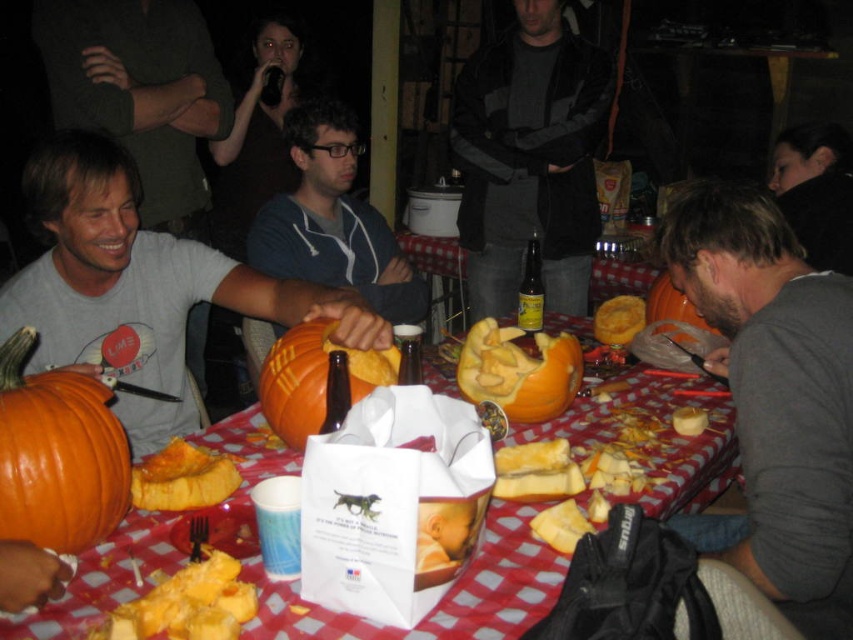
Question: Is yellow soft bread at lower left positioned at the back of carved orange pumpkin at center?

Choices:
 (A) no
 (B) yes

Answer: (A)

Question: Which point is closer to the camera?

Choices:
 (A) golden crispy bread at center
 (B) yellow soft bread at lower left
 (C) smooth pumpkin at center

Answer: (B)

Question: Which of these objects is positioned farthest from the gray cotton shirt at center?

Choices:
 (A) carved pumpkin at center
 (B) orange carved pumpkin at center
 (C) dark blue zip-up hoodie at center

Answer: (C)

Question: Is matte orange pumpkin at left positioned at the back of yellow crumbly cheese at center?

Choices:
 (A) no
 (B) yes

Answer: (B)

Question: Which object is farther from the camera taking this photo?

Choices:
 (A) gray cotton shirt at center
 (B) carved orange pumpkin at center

Answer: (B)

Question: Can you confirm if smooth pumpkin at center is bigger than dark gray jacket at center?

Choices:
 (A) no
 (B) yes

Answer: (B)